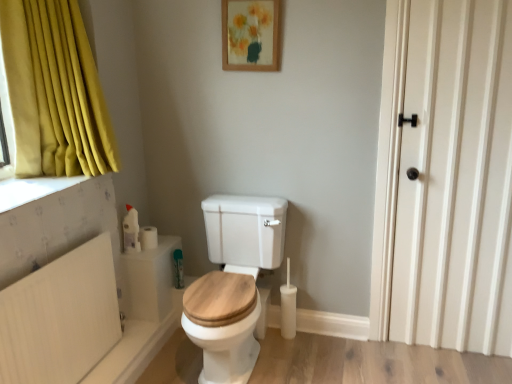
Question: Is white matte toilet paper at lower left, positioned as the first toilet paper in front-to-back order, next to white matte door at right?

Choices:
 (A) no
 (B) yes

Answer: (A)

Question: Is white matte toilet paper at lower left, positioned as the first toilet paper in front-to-back order, further to camera compared to white matte door at right?

Choices:
 (A) no
 (B) yes

Answer: (B)

Question: From a real-world perspective, is white matte toilet paper at lower left, positioned as the first toilet paper in front-to-back order, located beneath white matte door at right?

Choices:
 (A) yes
 (B) no

Answer: (A)

Question: Considering the relative sizes of white matte toilet paper at lower left, marked as the 2th toilet paper in a back-to-front arrangement, and white matte door at right in the image provided, is white matte toilet paper at lower left, marked as the 2th toilet paper in a back-to-front arrangement, taller than white matte door at right?

Choices:
 (A) yes
 (B) no

Answer: (B)

Question: Is white matte toilet paper at lower left, positioned as the first toilet paper in front-to-back order, thinner than white matte door at right?

Choices:
 (A) no
 (B) yes

Answer: (B)

Question: Is white matte toilet paper at lower left, positioned as the first toilet paper in front-to-back order, closer to camera compared to white matte door at right?

Choices:
 (A) yes
 (B) no

Answer: (B)

Question: Does white matte toilet paper at lower left, the second toilet paper viewed from the front, have a greater width compared to white matte toilet paper at lower left, positioned as the first toilet paper in front-to-back order?

Choices:
 (A) yes
 (B) no

Answer: (A)

Question: Does white matte toilet paper at lower left, the second toilet paper viewed from the front, have a greater height compared to white matte toilet paper at lower left, marked as the 2th toilet paper in a back-to-front arrangement?

Choices:
 (A) yes
 (B) no

Answer: (B)

Question: Is white matte toilet paper at lower left, the first toilet paper viewed from the back, far away from white matte toilet paper at lower left, marked as the 2th toilet paper in a back-to-front arrangement?

Choices:
 (A) yes
 (B) no

Answer: (B)

Question: Is white matte toilet paper at lower left, the first toilet paper viewed from the back, next to white matte toilet paper at lower left, marked as the 2th toilet paper in a back-to-front arrangement, and touching it?

Choices:
 (A) no
 (B) yes

Answer: (B)

Question: Would you say white matte toilet paper at lower left, the first toilet paper viewed from the back, contains white matte toilet paper at lower left, positioned as the first toilet paper in front-to-back order?

Choices:
 (A) no
 (B) yes

Answer: (A)

Question: From the image's perspective, is white matte toilet paper at lower left, the first toilet paper viewed from the back, located beneath white matte toilet paper at lower left, positioned as the first toilet paper in front-to-back order?

Choices:
 (A) yes
 (B) no

Answer: (A)

Question: Is white plastic radiator at lower left behind wooden toilet seat at center?

Choices:
 (A) yes
 (B) no

Answer: (B)